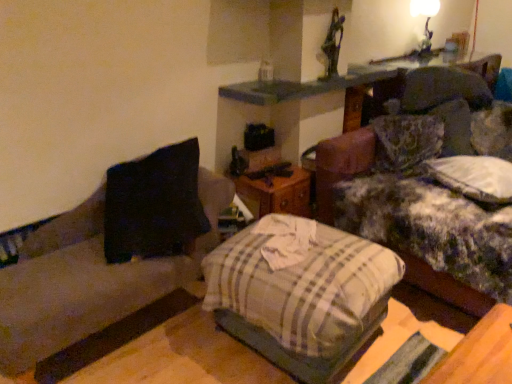
Image resolution: width=512 pixels, height=384 pixels. What do you see at coordinates (301, 295) in the screenshot? I see `plaid fabric pillow at center` at bounding box center [301, 295].

Image resolution: width=512 pixels, height=384 pixels. Describe the element at coordinates (425, 21) in the screenshot. I see `white glossy lampshade at upper right` at that location.

Image resolution: width=512 pixels, height=384 pixels. I want to click on fluffy fabric couch at upper right, so click(431, 186).

Identify the location of black fabric couch at left. Image resolution: width=512 pixels, height=384 pixels. (110, 254).

In order to click on plaid fabric pillow at center in this screenshot , I will do `click(301, 295)`.

I want to click on bed that appears on the right of black fabric couch at left, so click(301, 295).

Is point (121, 248) closer to viewer compared to point (368, 289)?

No.

Is black fabric couch at left bigger or smaller than plaid fabric pillow at center?

In the image, black fabric couch at left appears to be larger than plaid fabric pillow at center.

Is black fabric couch at left oriented away from plaid fabric pillow at center?

black fabric couch at left does not have its back to plaid fabric pillow at center.

Between white glossy lampshade at upper right and black fabric couch at left, which one has smaller size?

Smaller between the two is white glossy lampshade at upper right.

Is white glossy lampshade at upper right at the left side of black fabric couch at left?

In fact, white glossy lampshade at upper right is to the right of black fabric couch at left.

Between white glossy lampshade at upper right and black fabric couch at left, which one has smaller width?

white glossy lampshade at upper right is thinner.

How different are the orientations of white glossy lampshade at upper right and fluffy fabric couch at upper right in degrees?

90.8 degrees separate the facing orientations of white glossy lampshade at upper right and fluffy fabric couch at upper right.

Which of these two, white glossy lampshade at upper right or fluffy fabric couch at upper right, is bigger?

fluffy fabric couch at upper right is bigger.

Which object is wider, white glossy lampshade at upper right or fluffy fabric couch at upper right?

Wider between the two is fluffy fabric couch at upper right.

Who is more distant, white glossy lampshade at upper right or fluffy fabric couch at upper right?

Positioned behind is white glossy lampshade at upper right.

Is plaid fabric pillow at center not close to fluffy fabric couch at upper right?

No, plaid fabric pillow at center is not far away from fluffy fabric couch at upper right.

From the picture: Is plaid fabric pillow at center positioned with its back to fluffy fabric couch at upper right?

Absolutely, plaid fabric pillow at center is directed away from fluffy fabric couch at upper right.

Find the location of a particular element. This screenshot has height=384, width=512. couch above the plaid fabric pillow at center (from a real-world perspective) is located at coordinates (431, 186).

What's the angular difference between plaid fabric pillow at center and fluffy fabric couch at upper right's facing directions?

9.44 degrees separate the facing orientations of plaid fabric pillow at center and fluffy fabric couch at upper right.

Are white glossy lampshade at upper right and plaid fabric pillow at center far apart?

white glossy lampshade at upper right is far away from plaid fabric pillow at center.

Is white glossy lampshade at upper right positioned beyond the bounds of plaid fabric pillow at center?

Yes, white glossy lampshade at upper right is located beyond the bounds of plaid fabric pillow at center.

Does white glossy lampshade at upper right have a greater height compared to plaid fabric pillow at center?

Indeed, white glossy lampshade at upper right has a greater height compared to plaid fabric pillow at center.

You are a GUI agent. You are given a task and a screenshot of the screen. Output one action in this format:
    pyautogui.click(x=<x>, y=<y>)
    Task: Click on the light fixture above the plaid fabric pillow at center (from a real-world perspective)
    Image resolution: width=512 pixels, height=384 pixels.
    Given the screenshot: What is the action you would take?
    pyautogui.click(x=425, y=21)

Could you tell me if fluffy fabric couch at upper right is turned towards plaid fabric pillow at center?

Yes, fluffy fabric couch at upper right is facing plaid fabric pillow at center.

Which is in front, point (430, 93) or point (403, 266)?

The point (403, 266) is in front.

From the picture: Are fluffy fabric couch at upper right and plaid fabric pillow at center making contact?

fluffy fabric couch at upper right and plaid fabric pillow at center are clearly separated.

Which object is closer to the camera taking this photo, fluffy fabric couch at upper right or plaid fabric pillow at center?

Positioned in front is plaid fabric pillow at center.

At what (x,y) coordinates should I click in order to perform the action: click on couch above the black fabric couch at left (from a real-world perspective). Please return your answer as a coordinate pair (x, y). Looking at the image, I should click on (431, 186).

Can you tell me how much black fabric couch at left and fluffy fabric couch at upper right differ in facing direction?

black fabric couch at left and fluffy fabric couch at upper right are facing 93.5 degrees away from each other.

Is the surface of black fabric couch at left in direct contact with fluffy fabric couch at upper right?

There is a gap between black fabric couch at left and fluffy fabric couch at upper right.

Consider the image. Is fluffy fabric couch at upper right a part of black fabric couch at left?

Actually, fluffy fabric couch at upper right is outside black fabric couch at left.

Where is `studio couch above the plaid fabric pillow at center (from a real-world perspective)`? This screenshot has width=512, height=384. studio couch above the plaid fabric pillow at center (from a real-world perspective) is located at coordinates (110, 254).

This screenshot has width=512, height=384. Find the location of `studio couch below the white glossy lampshade at upper right (from the image's perspective)`. studio couch below the white glossy lampshade at upper right (from the image's perspective) is located at coordinates (110, 254).

Looking at the image, which one is located closer to plaid fabric pillow at center, black fabric couch at left or fluffy fabric couch at upper right?

black fabric couch at left.

Which object lies further to the anchor point plaid fabric pillow at center, fluffy fabric couch at upper right or black fabric couch at left?

Among the two, fluffy fabric couch at upper right is located further to plaid fabric pillow at center.

Estimate the real-world distances between objects in this image. Which object is further from white glossy lampshade at upper right, black fabric couch at left or plaid fabric pillow at center?

black fabric couch at left.

Based on their spatial positions, is white glossy lampshade at upper right or plaid fabric pillow at center closer to fluffy fabric couch at upper right?

plaid fabric pillow at center is closer to fluffy fabric couch at upper right.

When comparing their distances from white glossy lampshade at upper right, does fluffy fabric couch at upper right or plaid fabric pillow at center seem further?

plaid fabric pillow at center is positioned further to the anchor white glossy lampshade at upper right.

From the image, which object appears to be farther from fluffy fabric couch at upper right, black fabric couch at left or plaid fabric pillow at center?

black fabric couch at left is further to fluffy fabric couch at upper right.

Estimate the real-world distances between objects in this image. Which object is further from fluffy fabric couch at upper right, plaid fabric pillow at center or white glossy lampshade at upper right?

white glossy lampshade at upper right is positioned further to the anchor fluffy fabric couch at upper right.

Looking at the image, which one is located closer to white glossy lampshade at upper right, plaid fabric pillow at center or fluffy fabric couch at upper right?

fluffy fabric couch at upper right is positioned closer to the anchor white glossy lampshade at upper right.

Identify the location of bed located between black fabric couch at left and fluffy fabric couch at upper right in the left-right direction. This screenshot has height=384, width=512. (301, 295).

At what (x,y) coordinates should I click in order to perform the action: click on couch between black fabric couch at left and white glossy lampshade at upper right along the z-axis. Please return your answer as a coordinate pair (x, y). This screenshot has width=512, height=384. Looking at the image, I should click on (431, 186).

Locate an element on the screen. This screenshot has height=384, width=512. bed positioned between black fabric couch at left and white glossy lampshade at upper right from near to far is located at coordinates (301, 295).

Image resolution: width=512 pixels, height=384 pixels. What are the coordinates of `couch located between plaid fabric pillow at center and white glossy lampshade at upper right in the depth direction` in the screenshot? It's located at (431, 186).